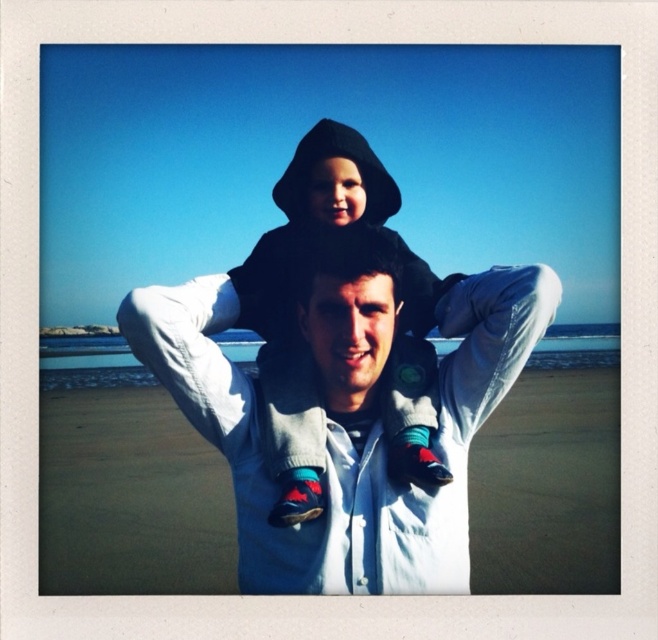
Between white matte jacket at center and black hoodie at center, which one appears on the left side from the viewer's perspective?

From the viewer's perspective, white matte jacket at center appears more on the left side.

Is white matte jacket at center below black hoodie at center?

Indeed, white matte jacket at center is positioned under black hoodie at center.

Does point (330, 445) come behind point (430, 323)?

No, (330, 445) is in front of (430, 323).

Where is `white matte jacket at center`? The height and width of the screenshot is (640, 658). white matte jacket at center is located at coordinates (349, 413).

Which is above, black hoodie at center or smooth white hoodie at center?

black hoodie at center is above.

Measure the distance between black hoodie at center and camera.

black hoodie at center is 6.34 meters away from camera.

Find the location of a particular element. The width and height of the screenshot is (658, 640). black hoodie at center is located at coordinates (x=290, y=305).

Is white matte jacket at center shorter than smooth white hoodie at center?

No, white matte jacket at center is not shorter than smooth white hoodie at center.

The width and height of the screenshot is (658, 640). Describe the element at coordinates (349, 413) in the screenshot. I see `white matte jacket at center` at that location.

At what (x,y) coordinates should I click in order to perform the action: click on white matte jacket at center. Please return your answer as a coordinate pair (x, y). This screenshot has width=658, height=640. Looking at the image, I should click on (349, 413).